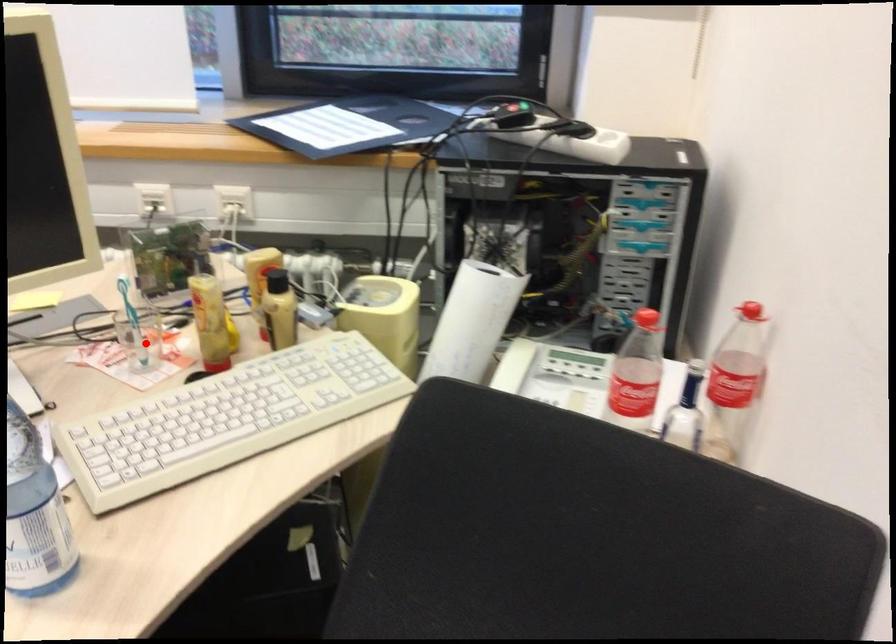
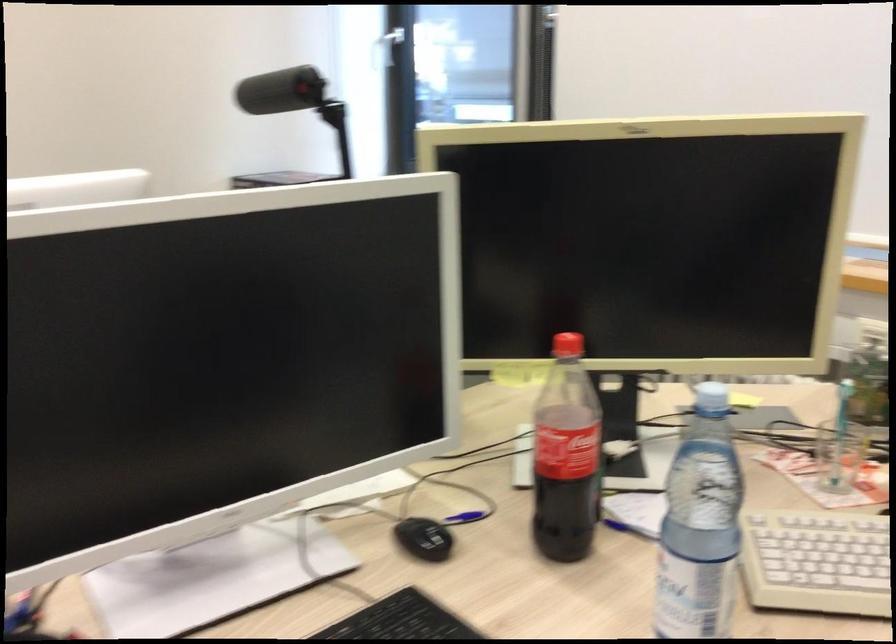
Where in the second image is the point corresponding to the highlighted location from the first image?

(839, 456)